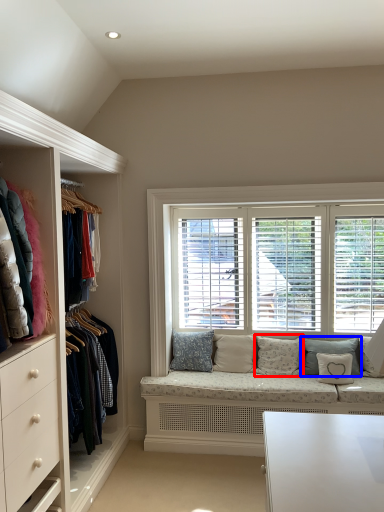
Question: Which object is further to the camera taking this photo, pillow (highlighted by a red box) or pillow (highlighted by a blue box)?

Choices:
 (A) pillow
 (B) pillow

Answer: (A)